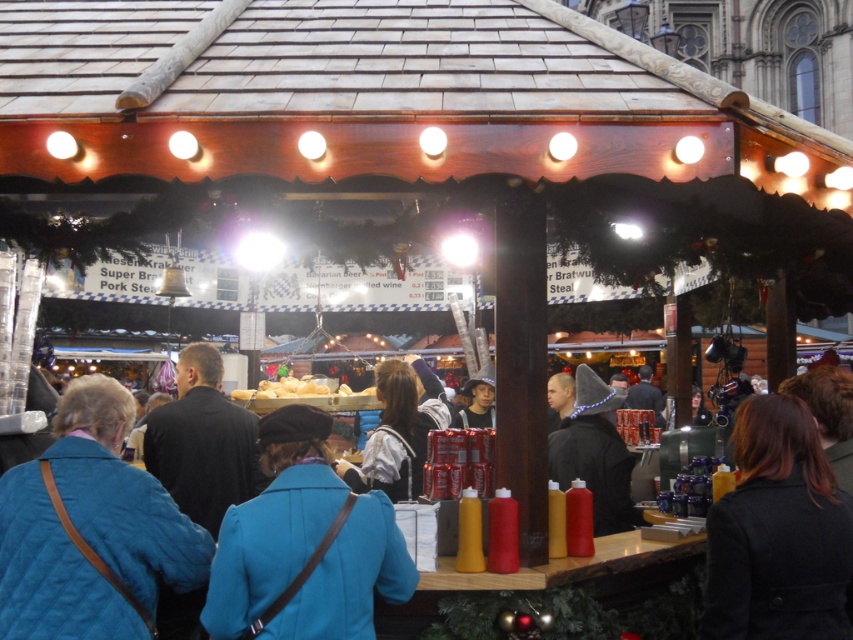
You are a customer at the Christmas market stall and want to pick up both the dark brown leather coat at lower right and the black woolen hat at center. Which item should you reach for first to avoid knocking over anything?

You should reach for the black woolen hat at center first because the dark brown leather coat at lower right is located below it, so reaching for the hat first will prevent disturbing the coat below.